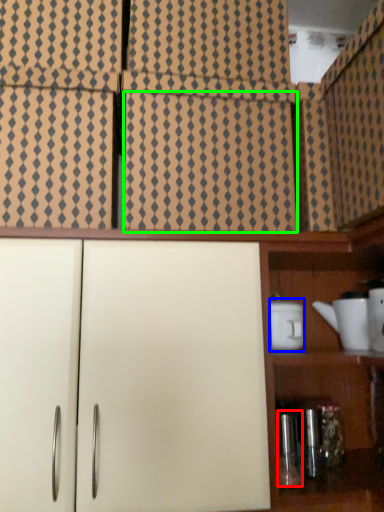
Question: Considering the real-world distances, which object is farthest from bottle (highlighted by a red box)? appliance (highlighted by a blue box) or tile (highlighted by a green box)?

Choices:
 (A) appliance
 (B) tile

Answer: (B)